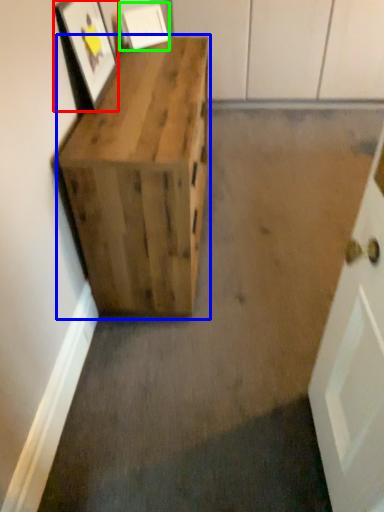
Question: Which object is positioned farthest from picture frame (highlighted by a red box)? Select from furniture (highlighted by a blue box) and picture frame (highlighted by a green box).

Choices:
 (A) furniture
 (B) picture frame

Answer: (B)